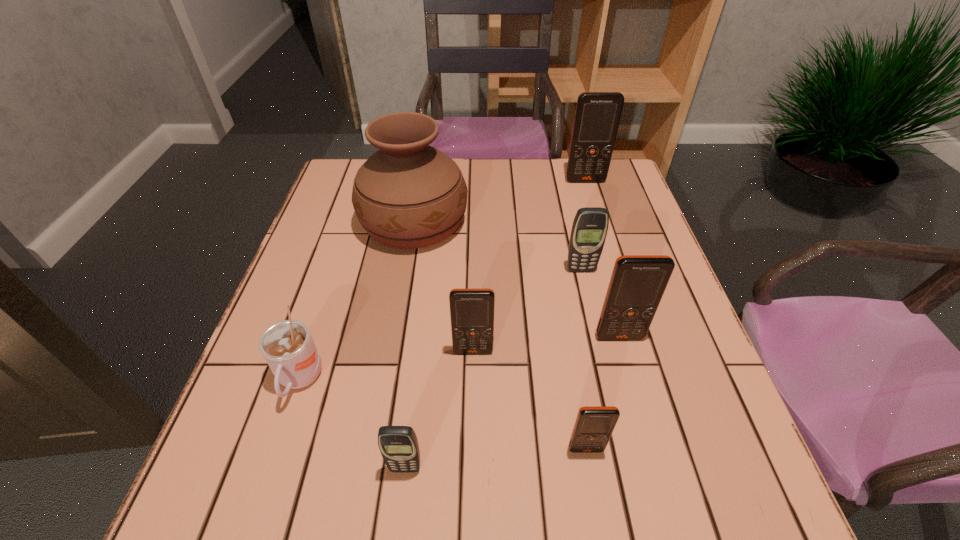
Locate an element on the screen. free space that is in between the leftmost orange cellular telephone and the tallest cellular telephone is located at coordinates (529, 266).

Identify the location of unoccupied position between the fourth farthest cellular telephone and the cup. This screenshot has width=960, height=540. (386, 366).

Locate an element on the screen. This screenshot has width=960, height=540. empty space that is in between the smaller gray cellular telephone and the smallest orange cellular telephone is located at coordinates (495, 458).

Identify which object is the third nearest to the cup. Please provide its 2D coordinates. Your answer should be formatted as a tuple, i.e. [(x, y)], where the tuple contains the x and y coordinates of a point satisfying the conditions above.

[(407, 195)]

The height and width of the screenshot is (540, 960). I want to click on object identified as the fifth closest to the smallest orange cellular telephone, so click(x=287, y=346).

The height and width of the screenshot is (540, 960). What are the coordinates of `cellular telephone that stands as the sixth closest to the cup` in the screenshot? It's located at (597, 116).

Locate an element on the screen. This screenshot has height=540, width=960. cellular telephone object that ranks as the second closest to the third orange cellular telephone from right to left is located at coordinates pos(471,310).

You are a GUI agent. You are given a task and a screenshot of the screen. Output one action in this format:
    pyautogui.click(x=<x>, y=<y>)
    Task: Click on the orange cellular telephone identified as the third closest to the cup
    
    Given the screenshot: What is the action you would take?
    pyautogui.click(x=638, y=282)

Identify which orange cellular telephone is the nearest to the second smallest orange cellular telephone. Please provide its 2D coordinates. Your answer should be formatted as a tuple, i.e. [(x, y)], where the tuple contains the x and y coordinates of a point satisfying the conditions above.

[(638, 282)]